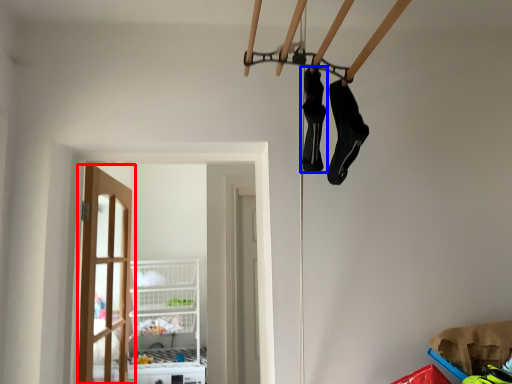
Question: Which object is further to the camera taking this photo, door (highlighted by a red box) or footwear (highlighted by a blue box)?

Choices:
 (A) door
 (B) footwear

Answer: (A)